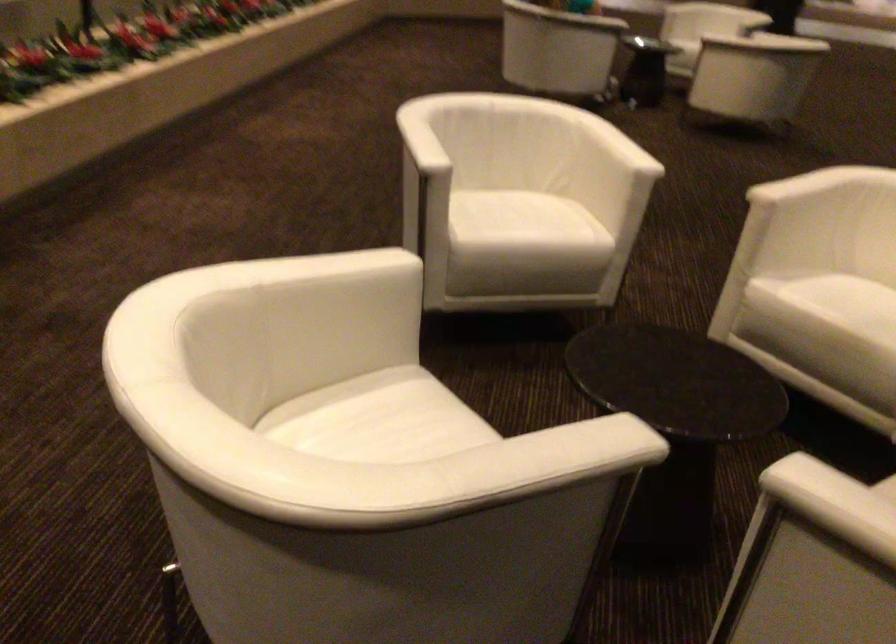
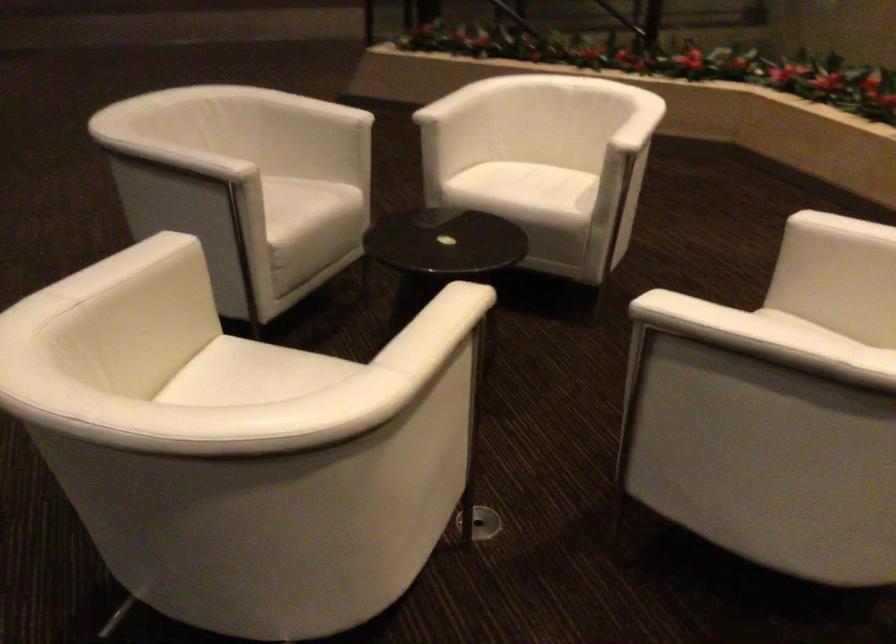
Where in the second image is the point corresponding to (x=416, y=462) from the first image?

(469, 89)